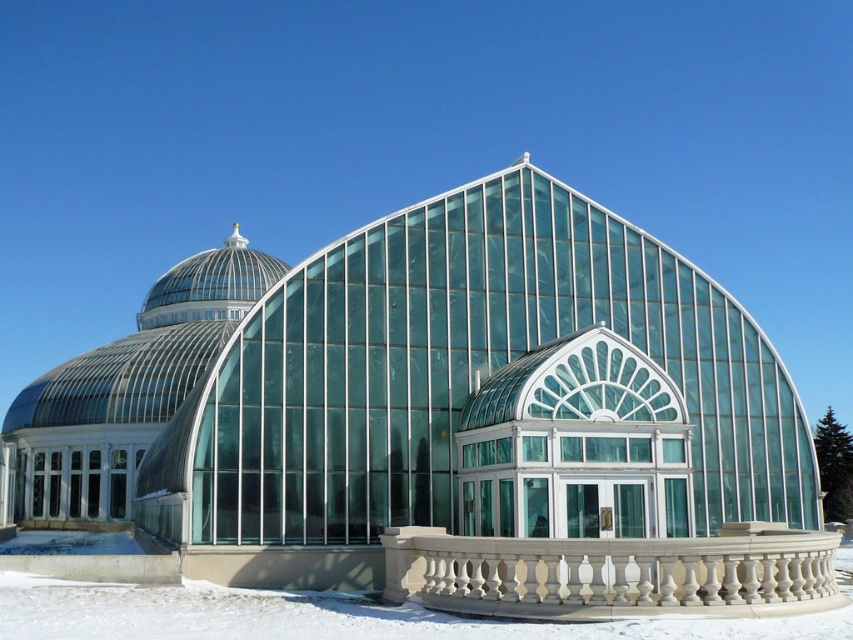
You are standing in the greenhouse and want to walk towards the white stone balustrade at center and the white powdery snow at lower center. Which object will you reach first?

You will reach the white stone balustrade at center first because it is closer to you than the white powdery snow at lower center.

You are standing in the greenhouse and want to walk from the white powdery snow at lower center to the white stone balustrade at center. Which direction should you move?

You should move to the right to reach the white stone balustrade at center from the white powdery snow at lower center because the white stone balustrade at center is located to the right of the white powdery snow at lower center.